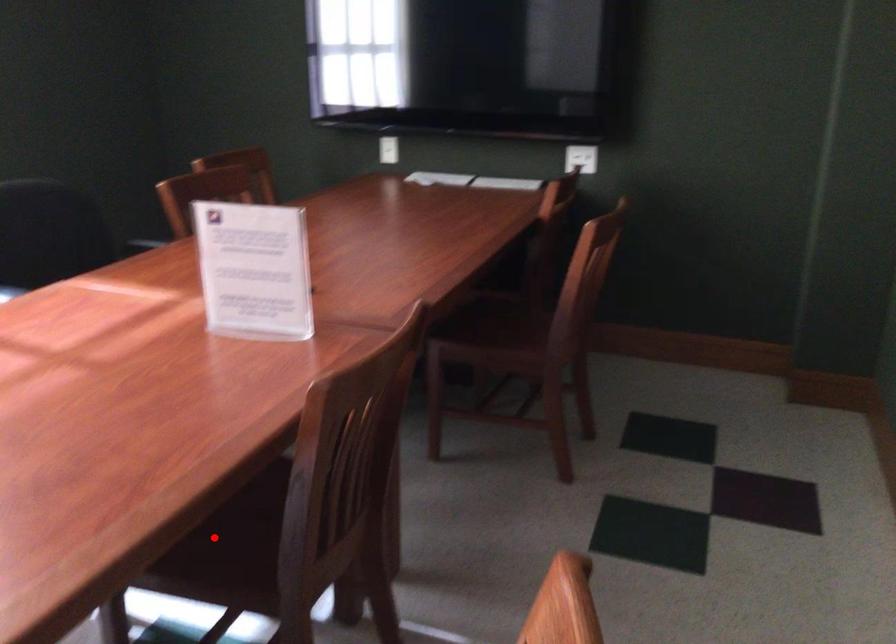
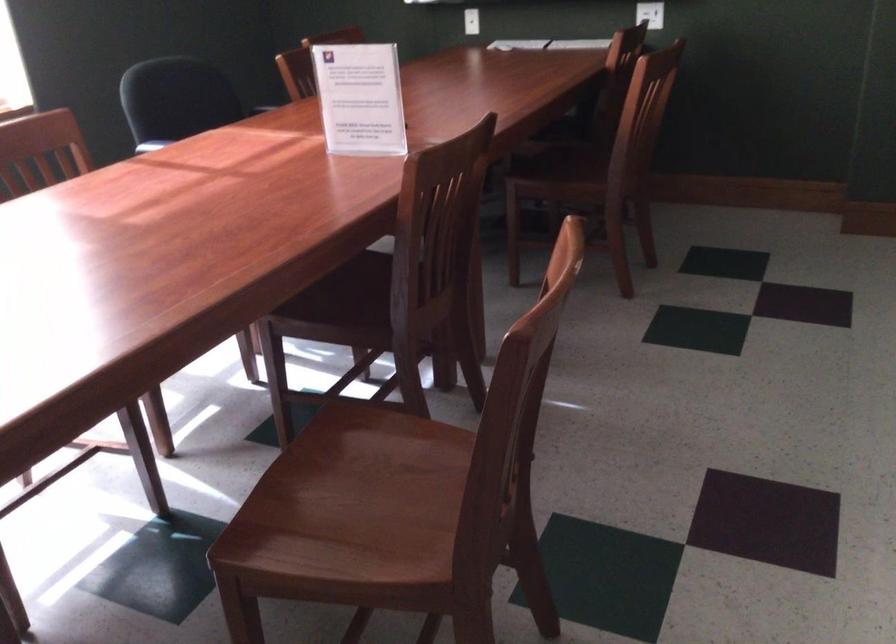
Question: I am providing you with two images of the same scene from different viewpoints. In image1, a red point is highlighted. Considering the same 3D point in image2, which of the following is correct?

Choices:
 (A) It is closer
 (B) It is farther

Answer: (B)